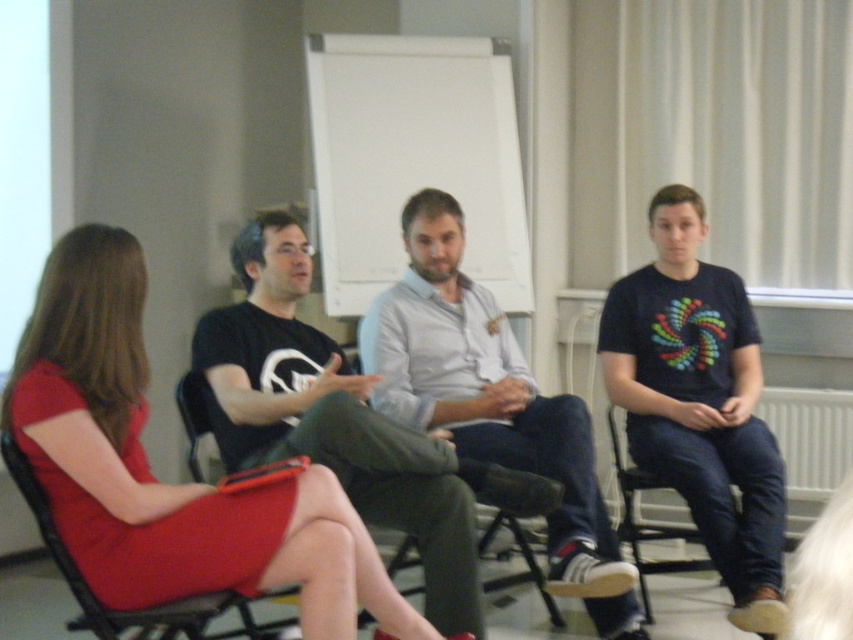
Question: Estimate the real-world distances between objects in this image. Which object is farther from the velvet red armchair at left?

Choices:
 (A) black fabric chair at lower right
 (B) light gray shirt at center
 (C) matte red dress at center

Answer: (A)

Question: Is matte red dress at center bigger than black fabric chair at lower right?

Choices:
 (A) yes
 (B) no

Answer: (B)

Question: Considering the relative positions of dark blue t-shirt at center and velvet red armchair at left in the image provided, where is dark blue t-shirt at center located with respect to velvet red armchair at left?

Choices:
 (A) right
 (B) left

Answer: (A)

Question: Does matte red dress at center appear under black fabric chair at lower right?

Choices:
 (A) no
 (B) yes

Answer: (A)

Question: Which point appears closest to the camera in this image?

Choices:
 (A) tap(18, 476)
 (B) tap(630, 484)

Answer: (A)

Question: Which object is farther from the camera taking this photo?

Choices:
 (A) light gray shirt at center
 (B) dark blue t-shirt at center
 (C) matte red dress at center
 (D) black fabric chair at lower right

Answer: (D)